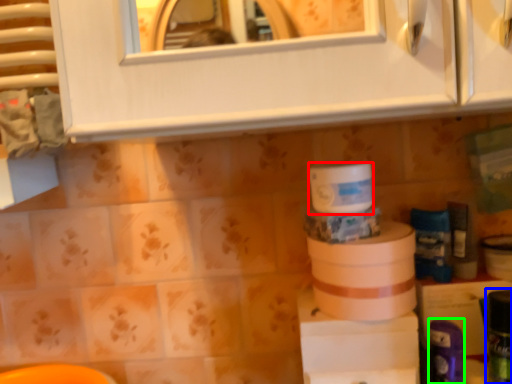
Question: Estimate the real-world distances between objects in this image. Which object is closer to toilet paper (highlighted by a red box), toiletry (highlighted by a blue box) or toiletry (highlighted by a green box)?

Choices:
 (A) toiletry
 (B) toiletry

Answer: (B)